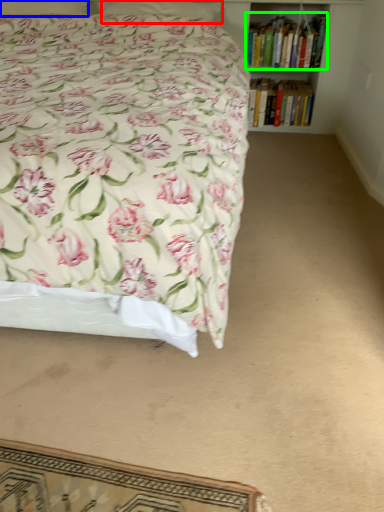
Question: Estimate the real-world distances between objects in this image. Which object is closer to pillow (highlighted by a red box), pillow (highlighted by a blue box) or book (highlighted by a green box)?

Choices:
 (A) pillow
 (B) book

Answer: (A)